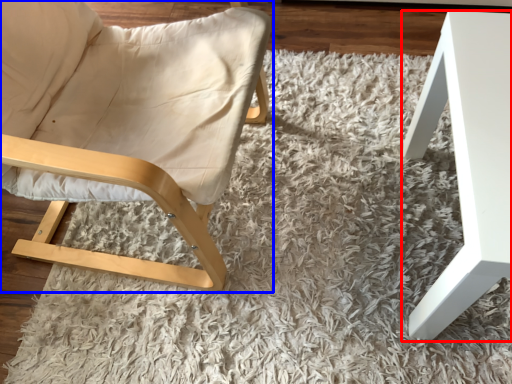
Question: Which object is further to the camera taking this photo, table (highlighted by a red box) or chair (highlighted by a blue box)?

Choices:
 (A) table
 (B) chair

Answer: (A)